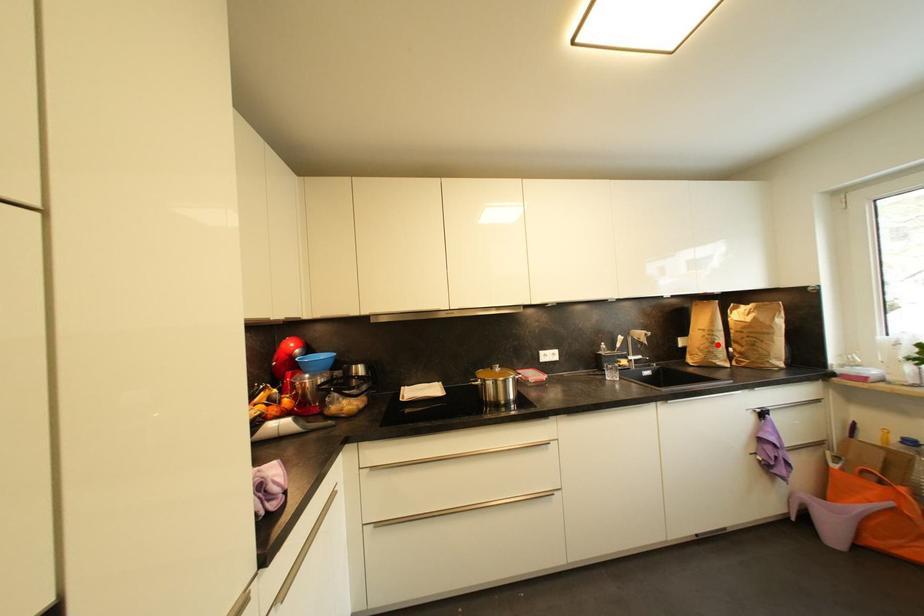
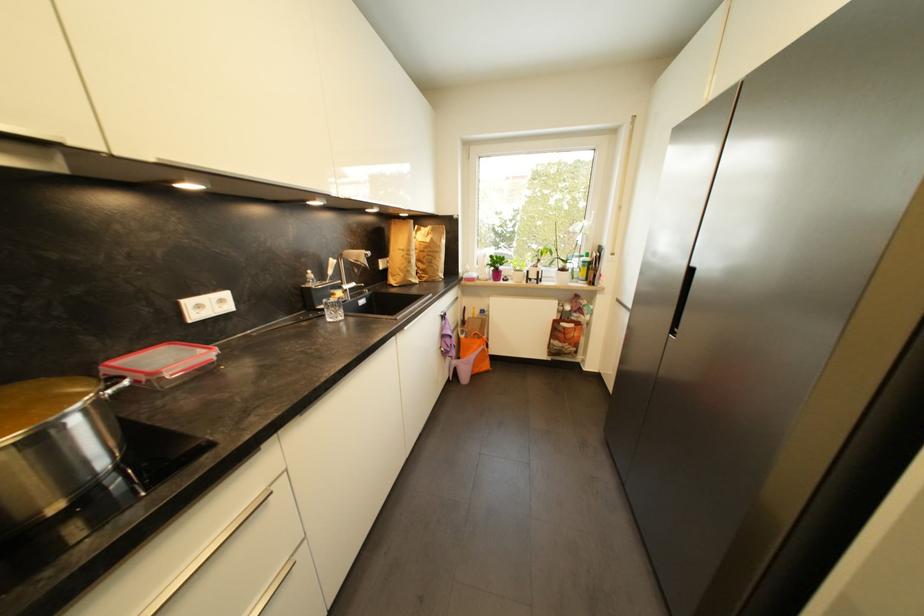
In the second image, find the point that corresponds to the highlighted location in the first image.

(415, 264)